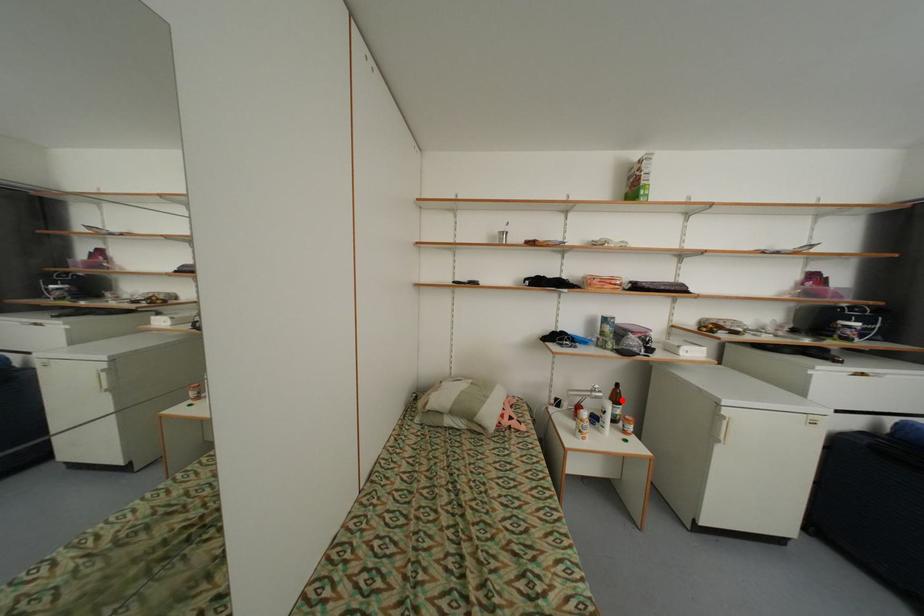
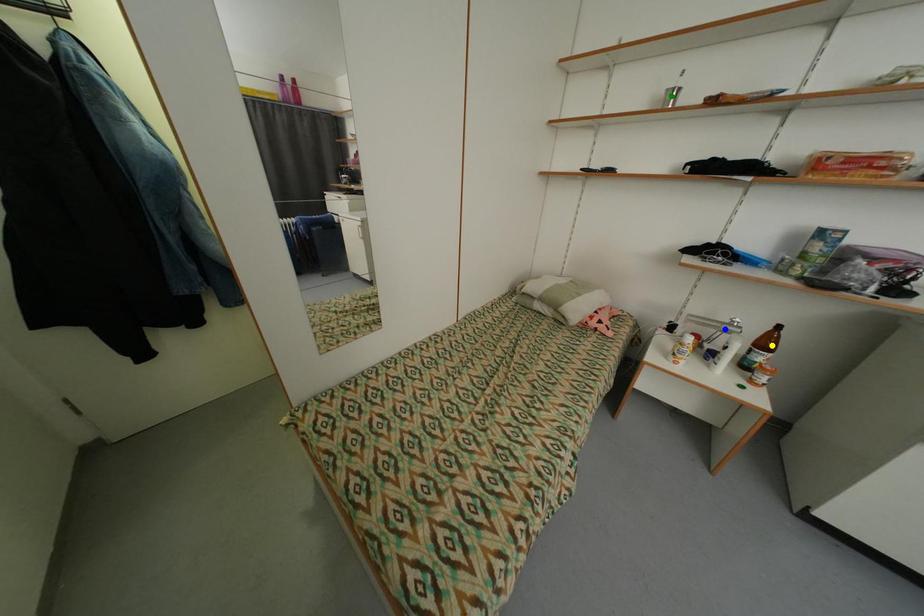
Question: I am providing you with two images of the same scene from different viewpoints. A red point is marked on the first image. You are given multiple points on the second image. Which point in image 2 is actually the same real-world point as the red point in image 1?

Choices:
 (A) blue point
 (B) yellow point
 (C) green point

Answer: (B)